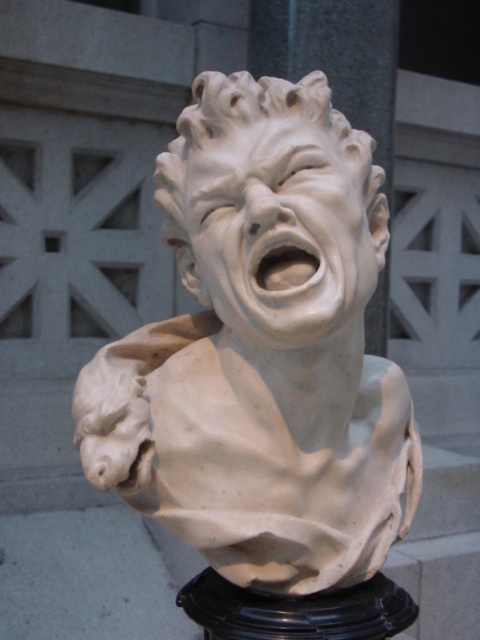
You are an art student observing the sculpture. You notice the white marble bust at center and the white marble face at center. Which one is positioned to the left?

The white marble bust at center is to the left of the white marble face at center.

You are an art conservator examining the sculpture. You notice that the white marble bust at center and the white marble face at center are both made of the same material. However, you need to determine which part requires more protective coating because it has a larger surface area. Which part should you apply more coating to?

The white marble bust at center requires more protective coating because it is larger in size than the white marble face at center, indicating a greater surface area that needs protection.

You are an art curator planning to display the white marble bust at center and the white marble face at center in a narrow hallway. The hallway is only 1 meter wide. Which object should you choose to ensure it fits within the hallway width?

The white marble face at center should be chosen because the white marble bust at center is wider and may not fit within the 1 meter width of the hallway.